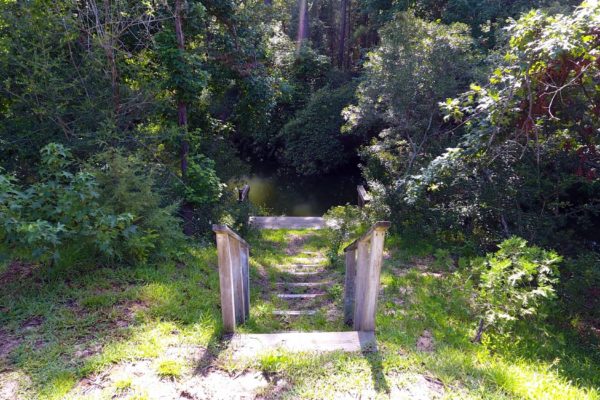
This screenshot has width=600, height=400. Identify the location of 1 top stair. (275, 335).